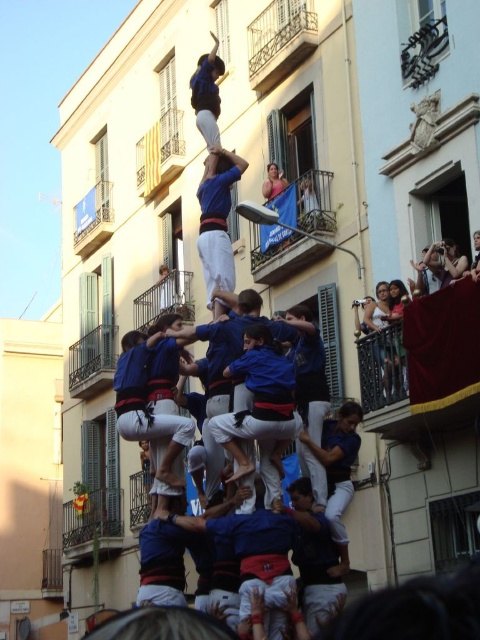
You are a photographer standing at the base of the human tower. You want to capture a photo that includes both the blue fabric at center and the matte blue shirt at upper center. Given that your camera has a maximum focus range of 3 meters, will you be able to capture both in focus without adjusting your position?

The distance between the blue fabric at center and the matte blue shirt at upper center is 3.03 meters. Since the camera can only focus within 3 meters, the distance exceeds the maximum range. Therefore, you won cannot capture both in focus without adjusting your position.

You are a photographer trying to capture the human tower in the image. You notice the metallic railing at upper center and the matte blue shirt at upper center are both in your frame. Which object takes up more space in the photo?

The matte blue shirt at upper center takes up more space in the photo because the metallic railing at upper center occupies less space than it.